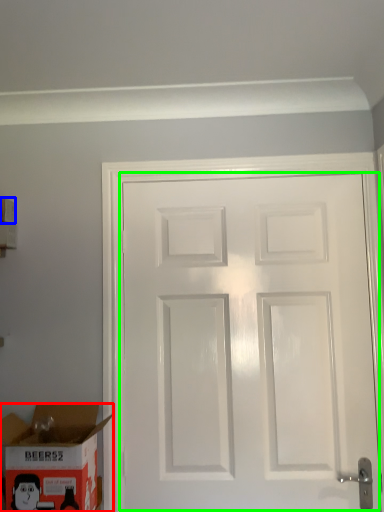
Question: Which is farther away from box (highlighted by a red box)? box (highlighted by a blue box) or door (highlighted by a green box)?

Choices:
 (A) box
 (B) door

Answer: (A)